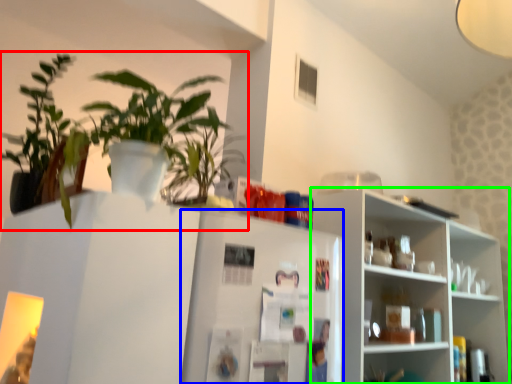
Question: Considering the real-world distances, which object is closest to houseplant (highlighted by a red box)? fridge (highlighted by a blue box) or shelf (highlighted by a green box).

Choices:
 (A) fridge
 (B) shelf

Answer: (A)